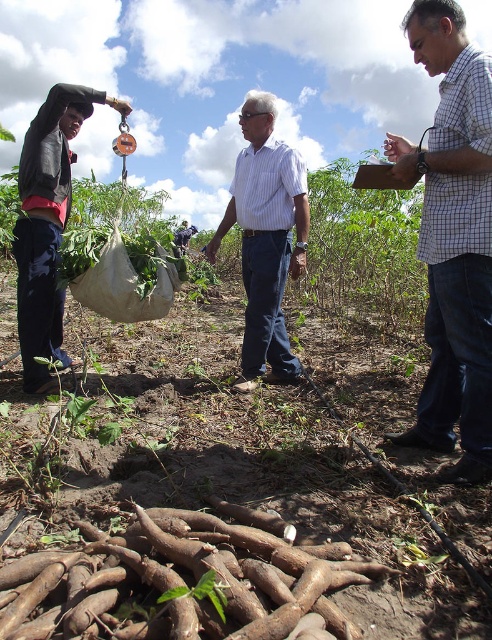
You are a farmer observing two workers in the field. You notice a white striped shirt at center and a light blue striped shirt at center. Which worker appears to have a thinner build based on their clothing?

The white striped shirt at center is thinner than the light blue striped shirt at center, indicating that the worker wearing the white striped shirt at center has a thinner build.

You are a photographer trying to capture the scene with the two people wearing white checkered shirt at center and light blue striped shirt at center. Which one is closer to the camera?

The white checkered shirt at center is in front of the light blue striped shirt at center, so the white checkered shirt at center is closer to the camera.